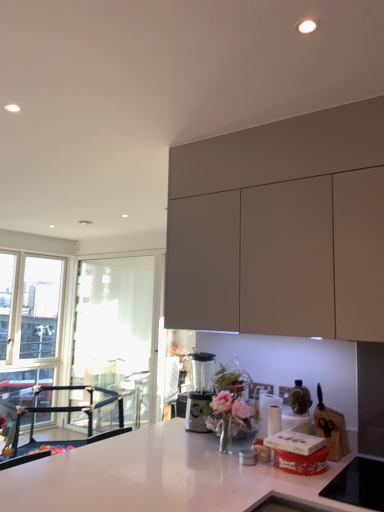
Question: Could you tell me if transparent glass window screen at left is facing matte gray cabinet at upper right?

Choices:
 (A) yes
 (B) no

Answer: (B)

Question: Is transparent glass window screen at left next to matte gray cabinet at upper right?

Choices:
 (A) yes
 (B) no

Answer: (B)

Question: Is transparent glass window screen at left further to the viewer compared to matte gray cabinet at upper right?

Choices:
 (A) no
 (B) yes

Answer: (B)

Question: Is transparent glass window screen at left looking in the opposite direction of matte gray cabinet at upper right?

Choices:
 (A) no
 (B) yes

Answer: (A)

Question: Can we say transparent glass window screen at left lies outside matte gray cabinet at upper right?

Choices:
 (A) yes
 (B) no

Answer: (A)

Question: Considering their positions, is transparent glass window screen at left located in front of or behind white glossy countertop at center?

Choices:
 (A) behind
 (B) front

Answer: (A)

Question: Does point (130, 420) appear closer or farther from the camera than point (46, 470)?

Choices:
 (A) farther
 (B) closer

Answer: (A)

Question: From the image's perspective, is transparent glass window screen at left positioned above or below white glossy countertop at center?

Choices:
 (A) above
 (B) below

Answer: (A)

Question: Is transparent glass window screen at left taller or shorter than white glossy countertop at center?

Choices:
 (A) tall
 (B) short

Answer: (A)

Question: In the image, is matte gray cabinet at upper right on the left side or the right side of white glossy countertop at center?

Choices:
 (A) left
 (B) right

Answer: (B)

Question: Looking at the image, does matte gray cabinet at upper right seem bigger or smaller compared to white glossy countertop at center?

Choices:
 (A) small
 (B) big

Answer: (A)

Question: Considering their positions, is matte gray cabinet at upper right located in front of or behind white glossy countertop at center?

Choices:
 (A) front
 (B) behind

Answer: (B)

Question: Is point (324, 148) closer or farther from the camera than point (16, 501)?

Choices:
 (A) farther
 (B) closer

Answer: (A)

Question: In the image, is white glossy countertop at center positioned in front of or behind shiny metallic bottle at center?

Choices:
 (A) front
 (B) behind

Answer: (A)

Question: From a real-world perspective, relative to shiny metallic bottle at center, is white glossy countertop at center vertically above or below?

Choices:
 (A) below
 (B) above

Answer: (A)